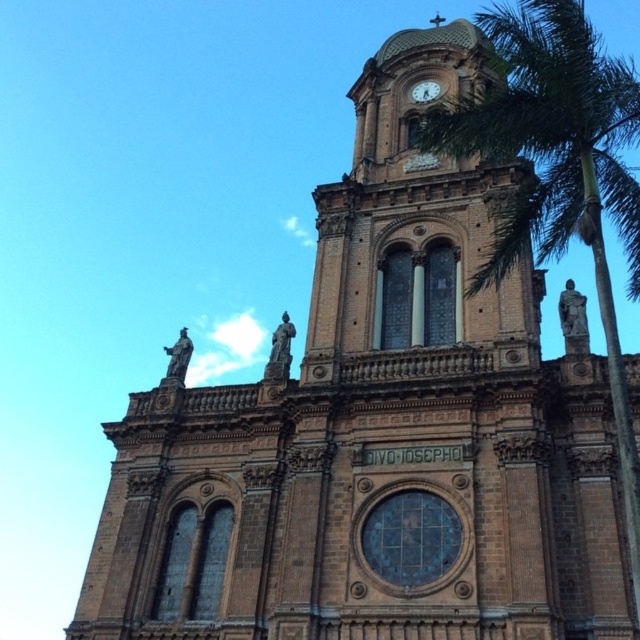
You are standing in front of the church and notice the green leafy palm tree at right and the gold metallic clock at upper center. Which object is positioned higher in the scene?

The green leafy palm tree at right is above the gold metallic clock at upper center, so it is positioned higher in the scene.

You are standing in front of the church and want to take a photo that includes both the green leafy palm tree at right and the gold metallic clock at upper center. Which object might block the view of the other when framing the shot?

The green leafy palm tree at right might block the view of the gold metallic clock at upper center because it could be wider than the clock.